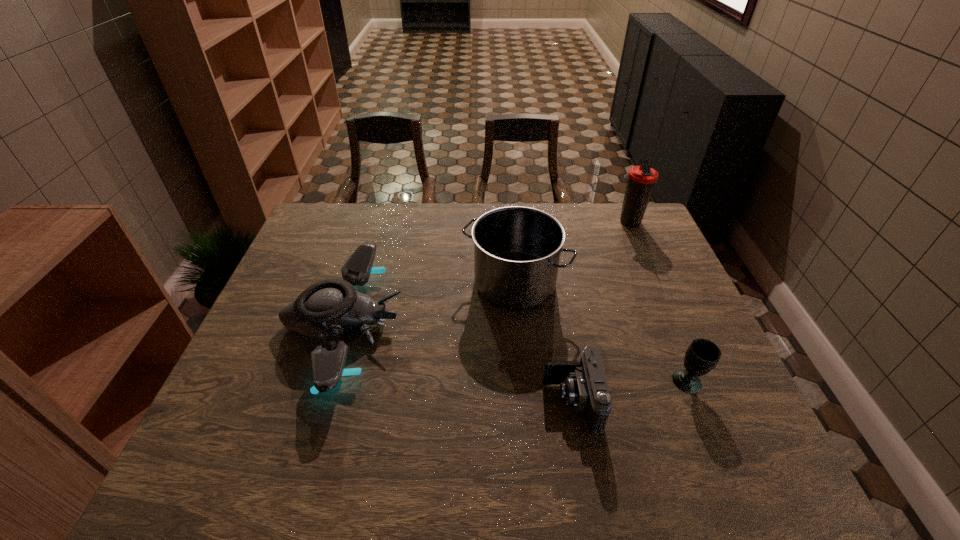
Find the location of a particular element. vacant space at the left edge of the desktop is located at coordinates (316, 271).

Where is `vacant area at the right edge`? vacant area at the right edge is located at coordinates (645, 245).

Where is `vacant region at the far left corner of the desktop`? The width and height of the screenshot is (960, 540). vacant region at the far left corner of the desktop is located at coordinates (310, 242).

You are a GUI agent. You are given a task and a screenshot of the screen. Output one action in this format:
    pyautogui.click(x=<x>, y=<y>)
    Task: Click on the vacant space at the far right corner of the desktop
    The width and height of the screenshot is (960, 540).
    Given the screenshot: What is the action you would take?
    pyautogui.click(x=612, y=239)

At what (x,y) coordinates should I click in order to perform the action: click on free point between the thermos bottle and the camera. Please return your answer as a coordinate pair (x, y). Looking at the image, I should click on (600, 312).

The image size is (960, 540). What are the coordinates of `free space between the thermos bottle and the camera` in the screenshot? It's located at (600, 312).

This screenshot has width=960, height=540. In order to click on unoccupied area between the camera and the thermos bottle in this screenshot , I will do `click(600, 312)`.

The height and width of the screenshot is (540, 960). Find the location of `empty space between the drone and the chalice`. empty space between the drone and the chalice is located at coordinates (516, 353).

This screenshot has width=960, height=540. What are the coordinates of `empty space that is in between the chalice and the camera` in the screenshot? It's located at (630, 392).

Find the location of a particular element. The image size is (960, 540). blank region between the second tallest object and the chalice is located at coordinates point(601,332).